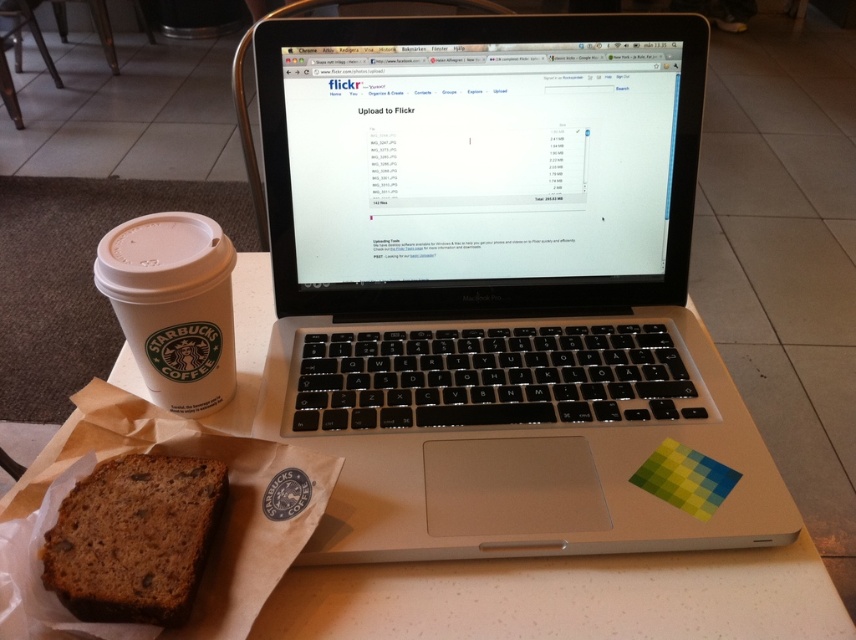
You are organizing items on a table and need to place a new item between the brown crumbly bread at lower left and the white matte cup at left. Given their sizes, which item should you place the new item closer to?

Since the brown crumbly bread at lower left occupies less space than the white matte cup at left, you should place the new item closer to the white matte cup at left to accommodate its larger size.

You are setting up a small coffee station for a meeting. You have a white paper napkin at lower left and a white matte cup at left. If the cup is placed 6.54 inches away from the napkin, will the napkin be within easy reach of the cup?

The distance between the white paper napkin at lower left and the white matte cup at left is 6.54 inches. Since this distance is relatively short, the napkin is within easy reach of the cup.